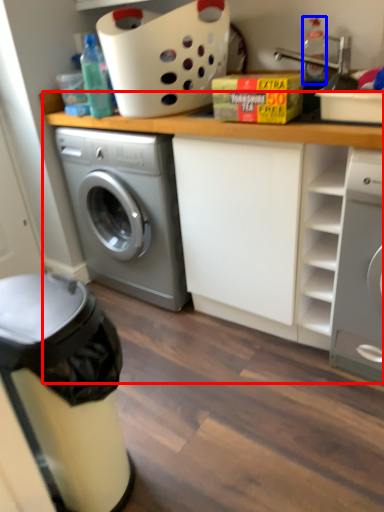
Question: Which point is closer to the camera, counter top (highlighted by a red box) or bottle (highlighted by a blue box)?

Choices:
 (A) counter top
 (B) bottle

Answer: (A)